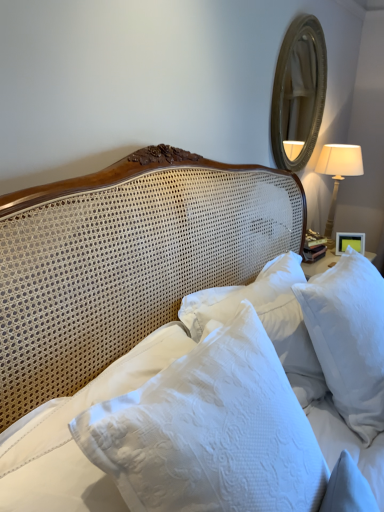
Question: Is white glossy picture frame at upper right to the left or to the right of white textured pillows at center in the image?

Choices:
 (A) left
 (B) right

Answer: (B)

Question: Is white glossy picture frame at upper right wider or thinner than white textured pillows at center?

Choices:
 (A) wide
 (B) thin

Answer: (B)

Question: Considering the real-world distances, which object is closest to the white fabric lampshade at right?

Choices:
 (A) gold-toned wooden mirror at upper right
 (B) white textured pillow at center, which is counted as the 1th pillow, starting from the left
 (C) white textured pillows at center
 (D) white glossy picture frame at upper right
 (E) white textured pillow at upper right, the second pillow in the left-to-right sequence

Answer: (D)

Question: Which object is positioned closest to the gold-toned wooden mirror at upper right?

Choices:
 (A) white textured pillow at upper right, the second pillow in the left-to-right sequence
 (B) white textured pillow at center, acting as the 2th pillow starting from the right
 (C) white textured pillows at center
 (D) white glossy picture frame at upper right
 (E) white fabric lampshade at right

Answer: (E)